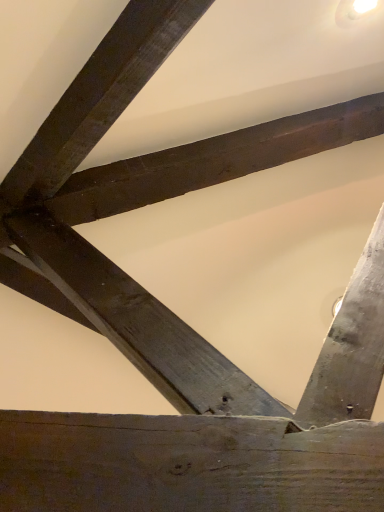
I want to click on dark brown wood at center, so click(139, 323).

In order to face dark brown wood at center, should I rotate leftwards or rightwards?

It's best to rotate left around 9.971 degrees.

What do you see at coordinates (139, 323) in the screenshot? I see `dark brown wood at center` at bounding box center [139, 323].

Image resolution: width=384 pixels, height=512 pixels. I want to click on dark brown wood at center, so click(x=139, y=323).